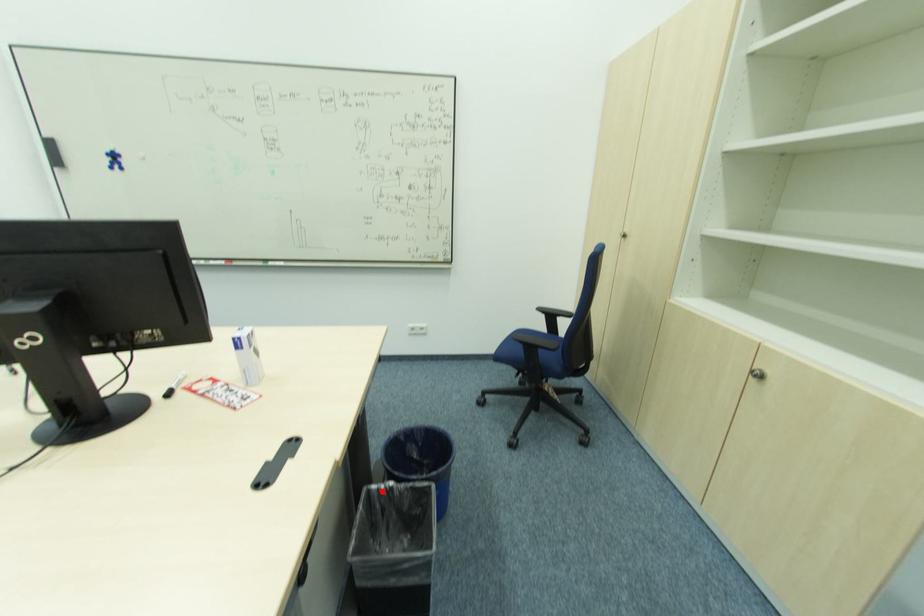
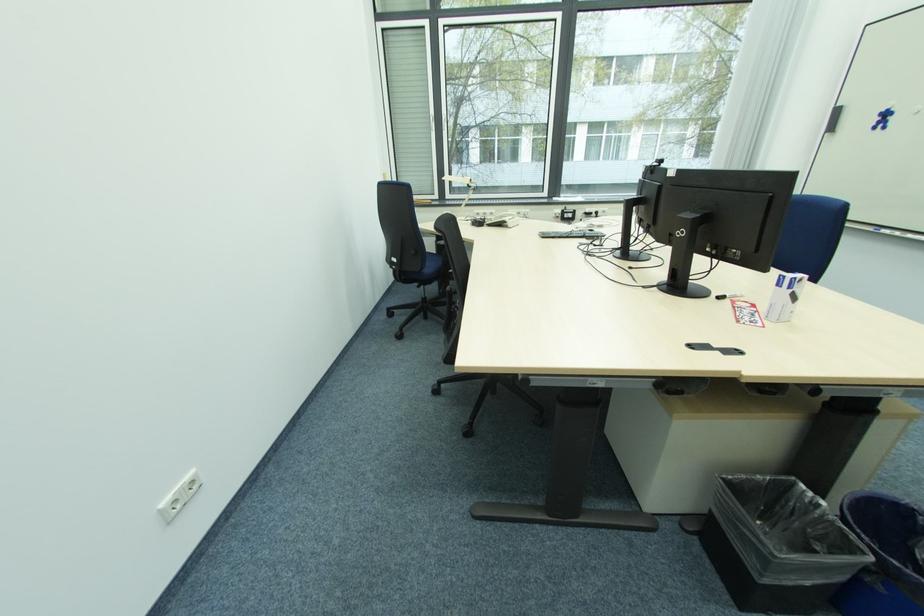
Question: I am providing you with two images of the same scene from different viewpoints. Given a red point in image1, look at the same physical point in image2. Is it:

Choices:
 (A) Closer to the viewpoint
 (B) Farther from the viewpoint

Answer: (A)